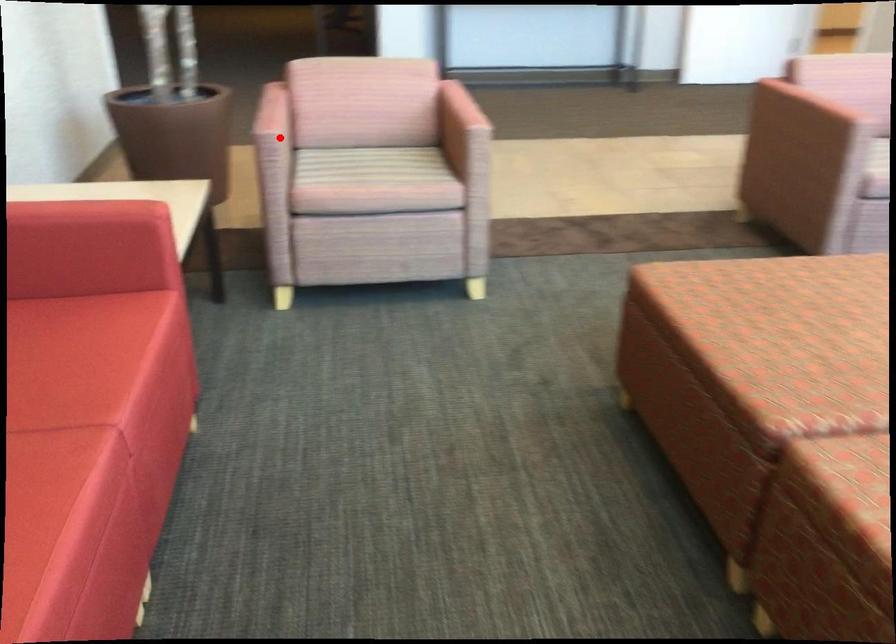
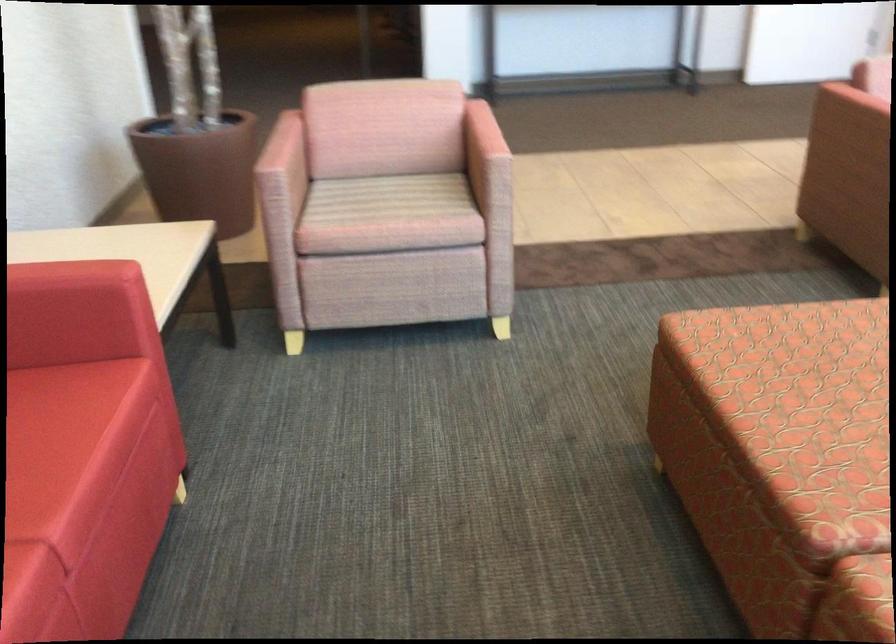
Where in the second image is the point corresponding to the highlighted location from the first image?

(280, 176)